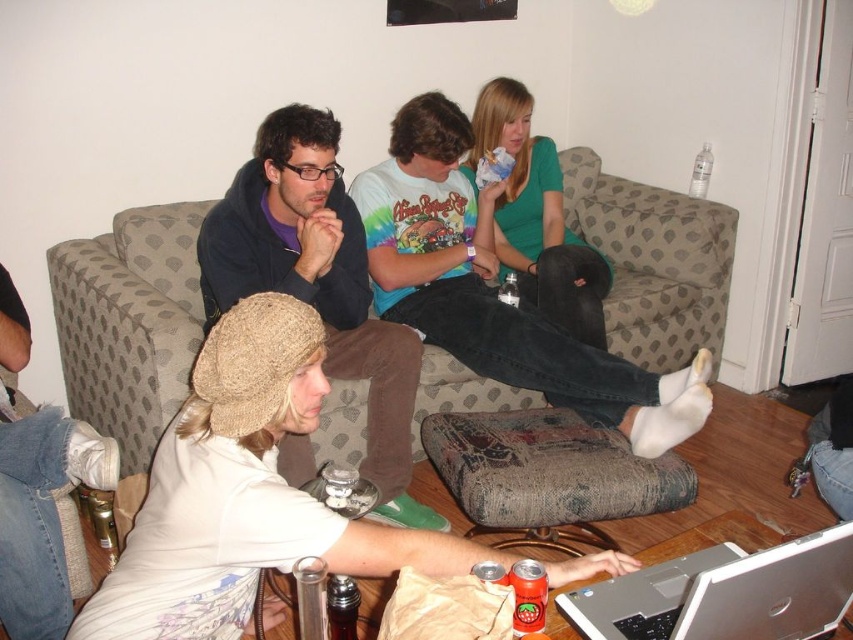
What object is located at the coordinate point (244, 492) in the image?

The point (244, 492) corresponds to the white knit hat at center.

You are planning to hang a picture frame between the matte black hoodie at center and the green matte shirt at upper center. Based on their positions, where should you place the frame so it is equidistant from both?

The matte black hoodie at center is located below the green matte shirt at upper center. To place the frame equidistant from both, position it halfway between them along the vertical axis.

You are a photographer wanting to take a picture of the group on the beige sofa. The camera is placed where the white knit hat at center is. Can you reach the camera from your current position without moving the camera?

The white knit hat at center and camera are 1.06 meters apart from each other. Since the camera is placed where the white knit hat at center is, you can reach the camera without moving it.